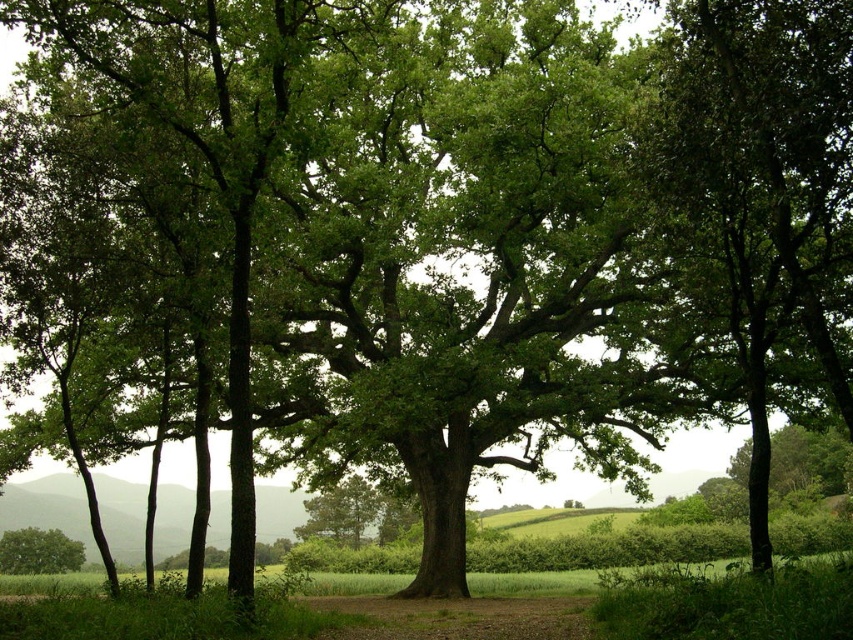
You are a hiker who wants to take a photo of both the green leafy tree at center and the green leafy tree at lower left. Which tree should you stand closer to in order to capture both in a single frame?

To capture both the green leafy tree at center and the green leafy tree at lower left in a single frame, you should stand closer to the green leafy tree at lower left since it is smaller in size and needs to be framed alongside the larger tree at center.

Looking at this image, you are standing in the middle of the natural landscape and want to walk towards the point that is closer to you. Which point should you head towards, point (343, 508) or point (33, 557)?

You should head towards point (33, 557) because it is closer to you than point (343, 508).

You are standing in a forest and see the green leafy tree at center and the green leafy tree at lower left. Which tree is positioned higher up in your field of view?

The green leafy tree at center is positioned higher up in your field of view because it is located above the green leafy tree at lower left.